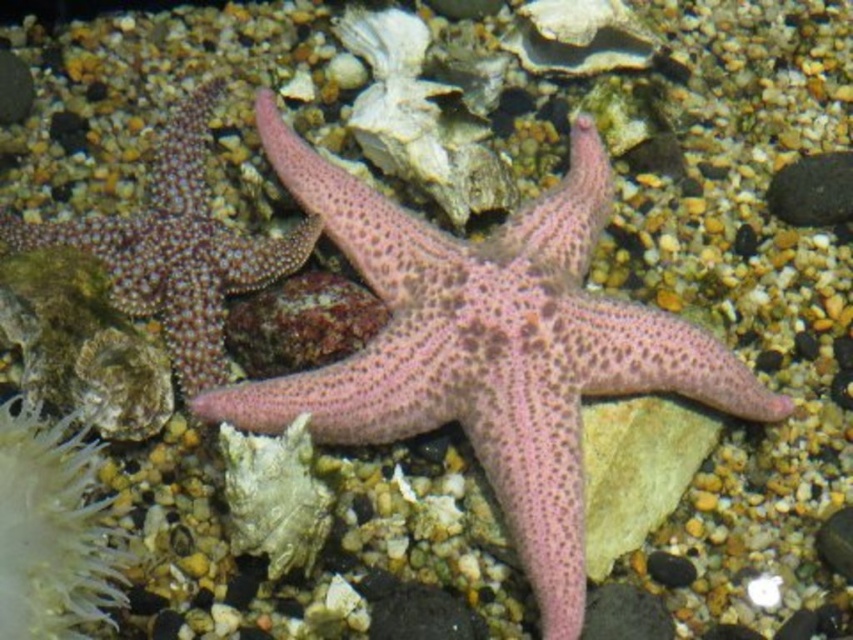
You are a marine biologist examining the marine environment shown. You notice the translucent gelatinous at lower left. Can you determine its exact location in the image using coordinates?

The translucent gelatinous at lower left is located at point (51, 531).

You are a marine biologist studying the marine environment. You notice a translucent gelatinous at lower left and a spongy pink starfish at center. If you want to collect both specimens, which one is closer to your current position?

The translucent gelatinous at lower left is 7.00 inches away from the spongy pink starfish at center. Since you are a marine biologist, your current position is not specified, but based on the given distance, the spongy pink starfish at center is closer to the translucent gelatinous at lower left than to your position. However, without knowing your exact location, it is impossible to determine which specimen is closer to you.